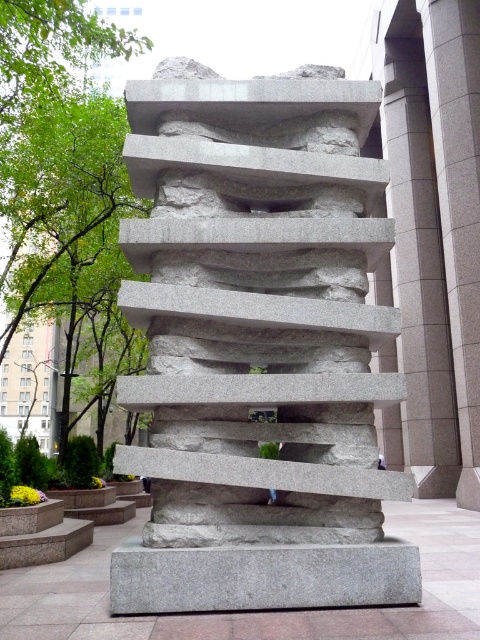
From the picture: You are an architect evaluating the structural integrity of the gray granite sculpture at center and the gray granite base at center. Which object is positioned higher in the vertical axis?

The gray granite sculpture at center is above the gray granite base at center, so it is positioned higher in the vertical axis.

You are standing at the base of the sculpture and want to take a photo that includes both the sculpture and the trees to the left. You have two points marked on your camera screen at coordinates point [202,144] and point [296,564]. Which point should you focus on to ensure the sculpture is in the foreground and the trees are in the background?

You should focus on point [296,564] because point [202,144] is behind it, meaning the sculpture at point [202,144] would be further away and the trees at point [296,564] would be closer, but according to the description, point [202,144] is behind point [296,564]. Wait, this seems contradictory. Let me correct that. Since point [202,144] is behind point [296,564], focusing on point [296,564] would place the sculpture in the foreground and the trees in the background.

You are standing in front of the sculpture and want to take a photo. The camera you are using has a focal length of 50mm and a sensor size of 24mm x 36mm. The point at coordinates point (243, 116) is part of the sculpture. If you want to ensure that this point is in focus, what is the minimum distance you should be from the sculpture?

The minimum distance you should be from the sculpture is 5.35 meters to ensure the point at coordinates point (243, 116) is in focus because the distance of point (243, 116) from camera is 5.35 meters.